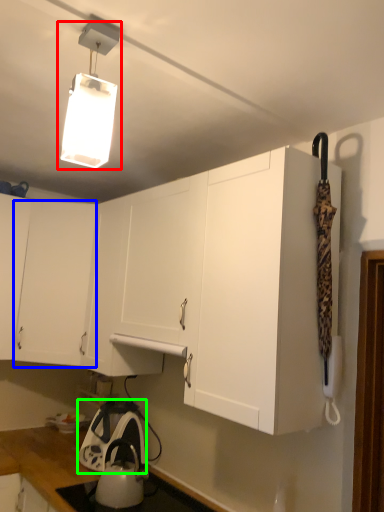
Question: Considering the real-world distances, which object is closest to lamp (highlighted by a red box)? cabinetry (highlighted by a blue box) or appliance (highlighted by a green box).

Choices:
 (A) cabinetry
 (B) appliance

Answer: (A)